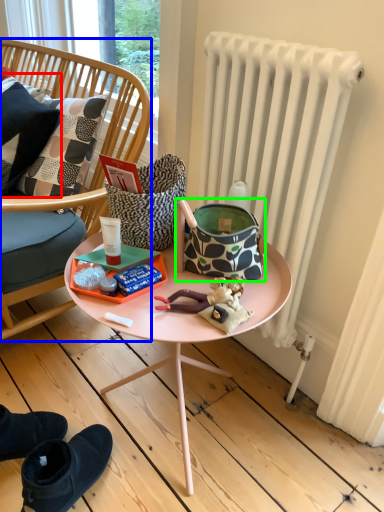
Question: Which object is positioned closest to pillow (highlighted by a red box)? Select from chair (highlighted by a blue box) and handbag (highlighted by a green box).

Choices:
 (A) chair
 (B) handbag

Answer: (A)